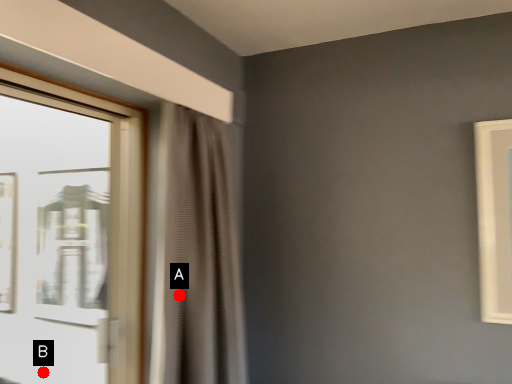
Question: Two points are circled on the image, labeled by A and B beside each circle. Among these points, which one is nearest to the camera?

Choices:
 (A) A is closer
 (B) B is closer

Answer: (A)